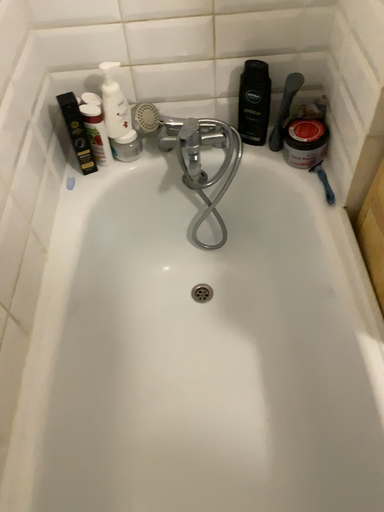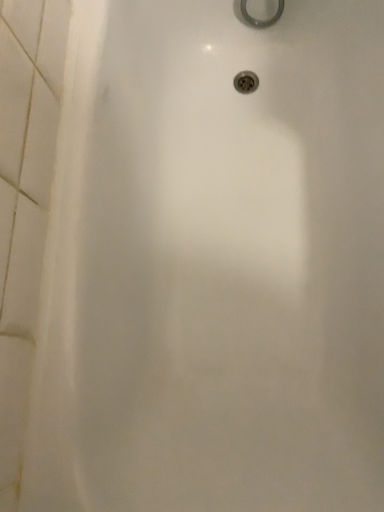
Question: Which way did the camera rotate in the video?

Choices:
 (A) rotated downward
 (B) rotated upward

Answer: (A)